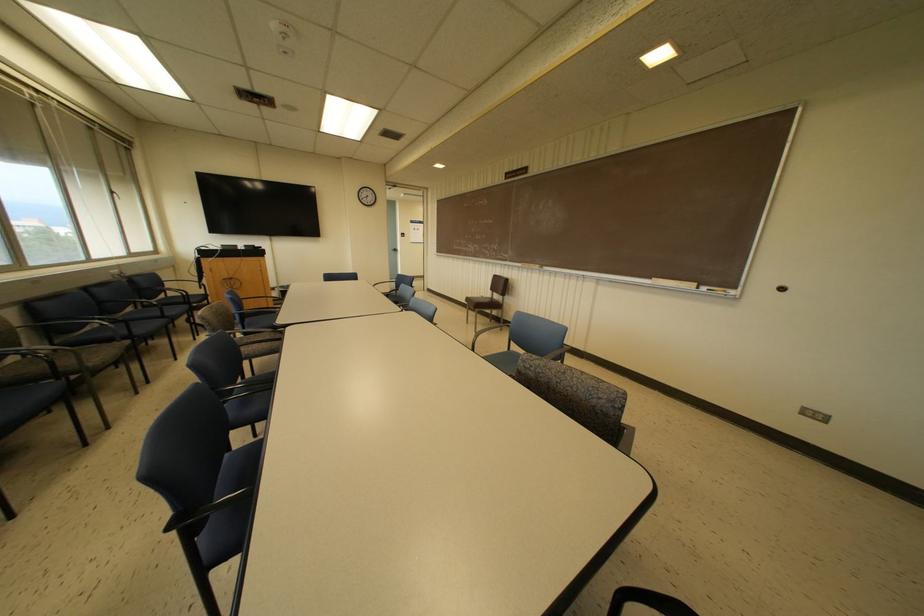
Find where to sit the patterned chair sitting surface. Please return your answer as a coordinate pair (x, y).

(14, 400)